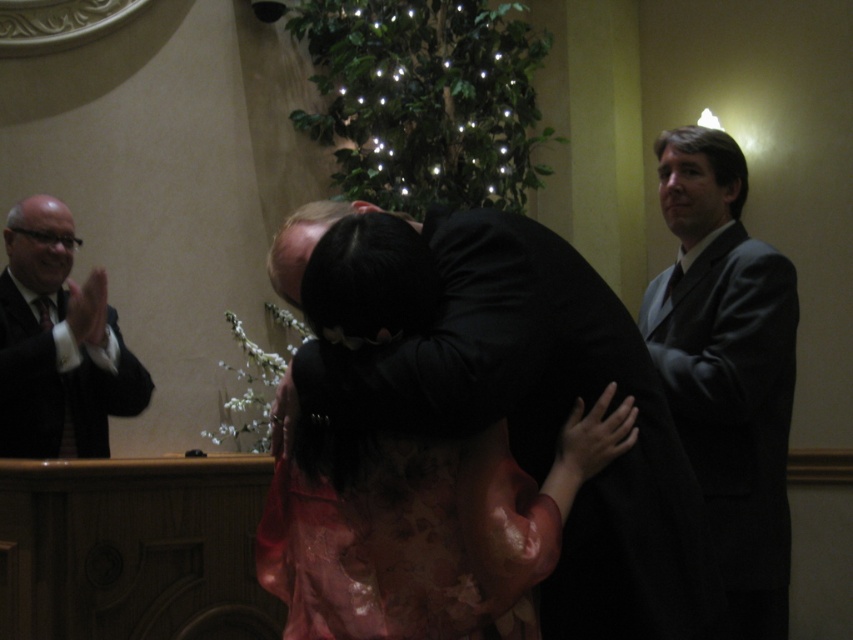
Question: Can you confirm if floral lace dress at center is thinner than black suit at left?

Choices:
 (A) yes
 (B) no

Answer: (B)

Question: Among these points, which one is nearest to the camera?

Choices:
 (A) (776, 436)
 (B) (286, 244)

Answer: (B)

Question: Is dark gray suit at right positioned behind floral lace dress at center?

Choices:
 (A) yes
 (B) no

Answer: (A)

Question: Does floral lace dress at center appear on the right side of black suit at left?

Choices:
 (A) yes
 (B) no

Answer: (A)

Question: Which point appears farthest from the camera in this image?

Choices:
 (A) (32, 428)
 (B) (752, 321)
 (C) (314, 612)

Answer: (A)

Question: Which point is closer to the camera?

Choices:
 (A) (669, 173)
 (B) (27, 410)
 (C) (440, 484)

Answer: (C)